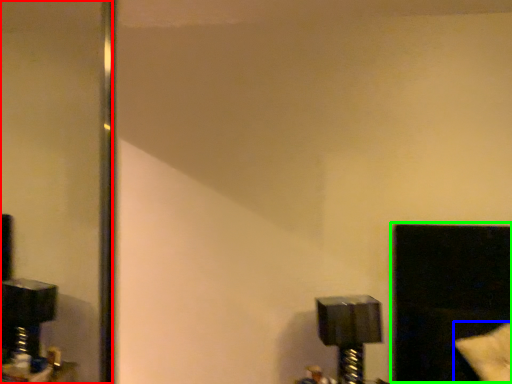
Question: Which object is positioned farthest from mirror (highlighted by a red box)? Select from pillow (highlighted by a blue box) and window (highlighted by a green box).

Choices:
 (A) pillow
 (B) window

Answer: (A)